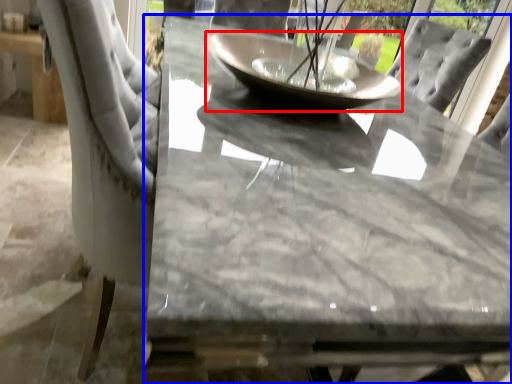
Question: Among these objects, which one is nearest to the camera, glass bowl (highlighted by a red box) or table (highlighted by a blue box)?

Choices:
 (A) glass bowl
 (B) table

Answer: (B)